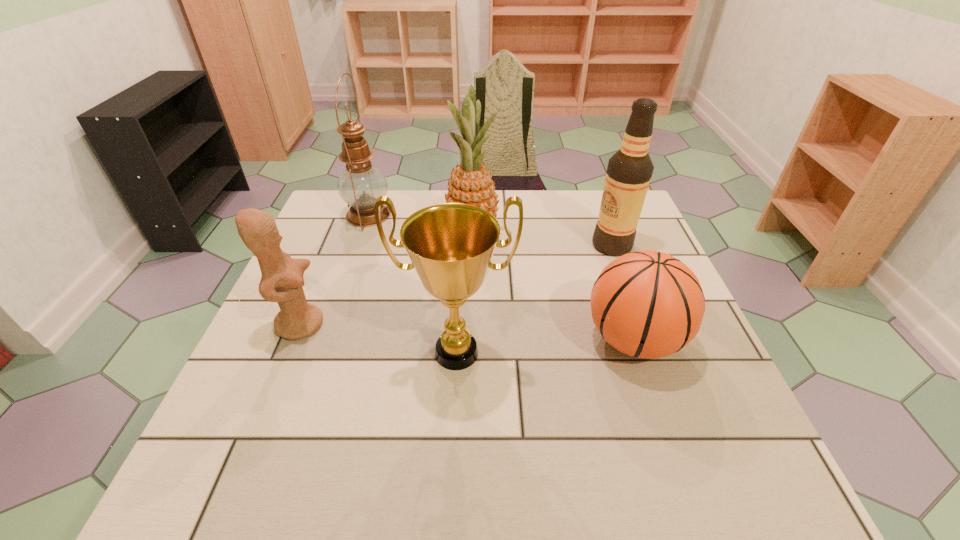
Where is `vacant area situated on the label of the alcohol`? vacant area situated on the label of the alcohol is located at coordinates 495,245.

This screenshot has height=540, width=960. What are the coordinates of `vacant point located on the front view with handles of the award` in the screenshot? It's located at (453, 423).

Locate an element on the screen. vacant space located 0.050m on the front-facing side of the second shortest object is located at coordinates (347, 323).

This screenshot has height=540, width=960. In order to click on vacant space located 0.390m on the back of the shortest object in this screenshot , I will do `click(590, 213)`.

Identify the location of oil lamp located in the far edge section of the desktop. (360, 184).

Identify the location of pineapple located at the far edge. (471, 183).

This screenshot has width=960, height=540. Find the location of `alcohol present at the far edge`. alcohol present at the far edge is located at coordinates (629, 171).

Find the location of a particular element. This screenshot has width=960, height=540. oil lamp that is at the left edge is located at coordinates (360, 184).

Identify the location of figurine located in the left edge section of the desktop. Image resolution: width=960 pixels, height=540 pixels. (282, 279).

Where is `alcohol that is at the right edge`? alcohol that is at the right edge is located at coordinates (x=629, y=171).